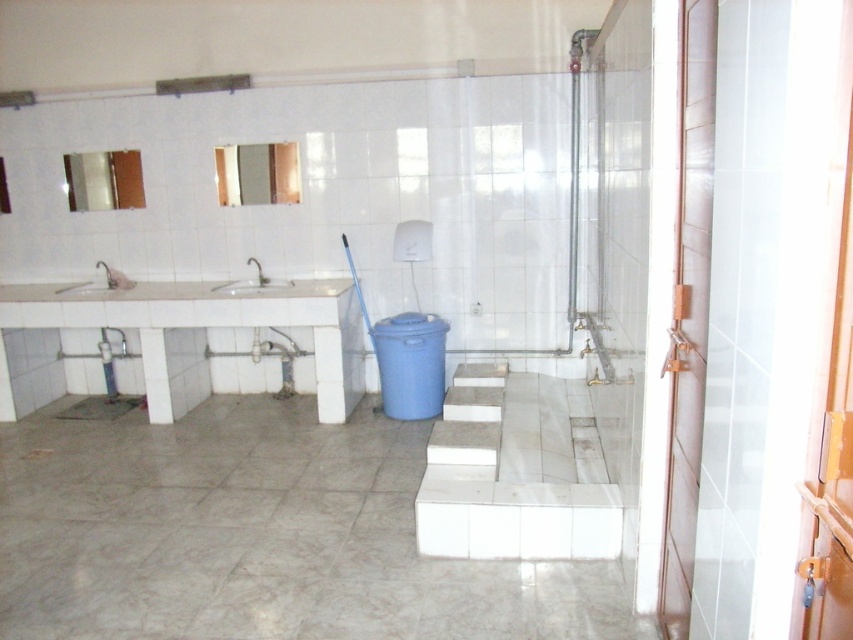
Which is above, white glossy sink at center or white glossy sink at left?

white glossy sink at center is above.

Is point (244, 289) closer to viewer compared to point (82, 282)?

Yes, point (244, 289) is closer to viewer.

Which is behind, point (267, 285) or point (115, 284)?

The point (115, 284) is more distant.

This screenshot has width=853, height=640. I want to click on white glossy sink at center, so pos(252,282).